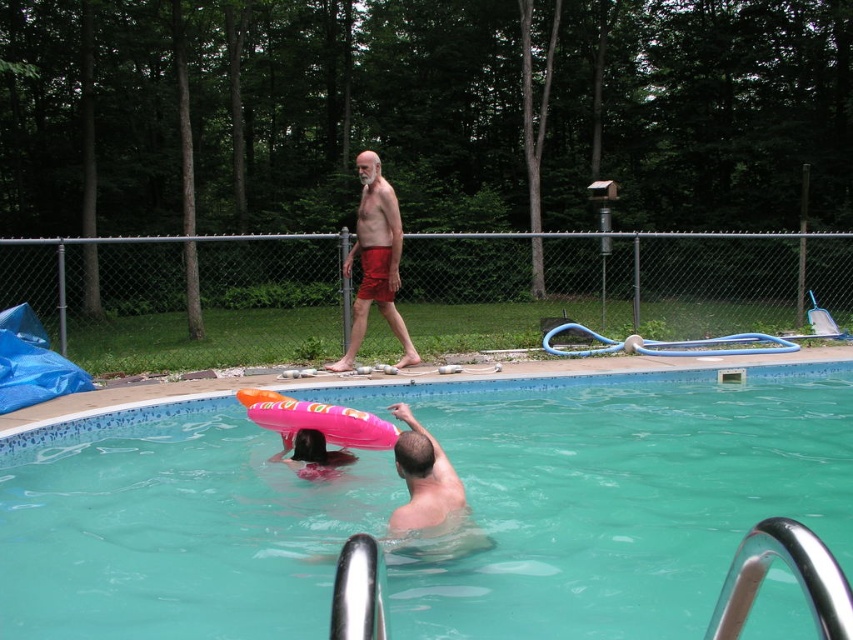
Who is shorter, teal smooth water at center or matte red shorts at center?

Standing shorter between the two is teal smooth water at center.

Who is more forward, (79, 435) or (392, 209)?

Point (79, 435) is more forward.

This screenshot has height=640, width=853. I want to click on teal smooth water at center, so click(616, 497).

This screenshot has width=853, height=640. In order to click on teal smooth water at center in this screenshot , I will do `click(616, 497)`.

Is teal smooth water at center positioned before pink foam float at lower center?

No, it is not.

Is point (662, 492) positioned before point (300, 436)?

No, it is not.

At what (x,y) coordinates should I click in order to perform the action: click on teal smooth water at center. Please return your answer as a coordinate pair (x, y). This screenshot has height=640, width=853. Looking at the image, I should click on (616, 497).

Does matte red shorts at center appear over pink foam float at lower center?

Yes, matte red shorts at center is above pink foam float at lower center.

What do you see at coordinates (375, 260) in the screenshot? I see `matte red shorts at center` at bounding box center [375, 260].

Identify the location of matte red shorts at center. (375, 260).